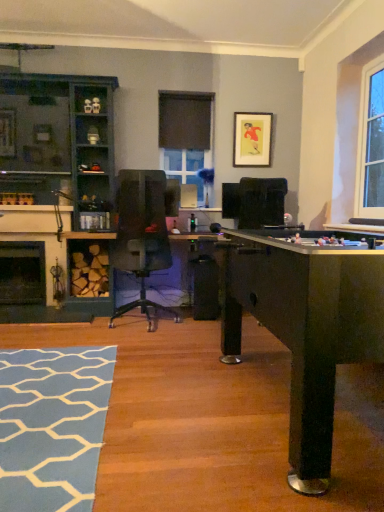
You are a GUI agent. You are given a task and a screenshot of the screen. Output one action in this format:
    pyautogui.click(x=<x>, y=<y>)
    Task: Click on the unoccupied region to the right of blue textured rug at lower left
    
    Given the screenshot: What is the action you would take?
    pyautogui.click(x=197, y=410)